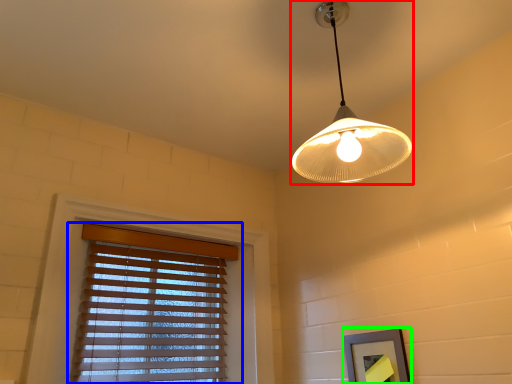
Question: Considering the real-world distances, which object is farthest from lamp (highlighted by a red box)? window blind (highlighted by a blue box) or picture frame (highlighted by a green box)?

Choices:
 (A) window blind
 (B) picture frame

Answer: (A)